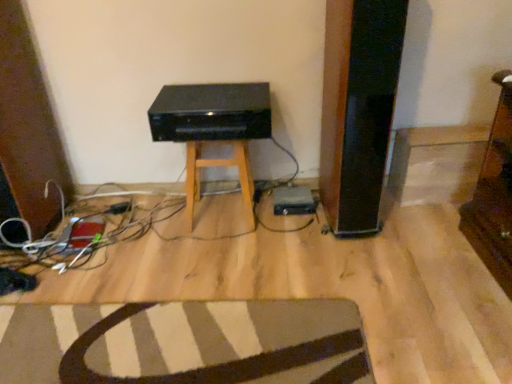
Image resolution: width=512 pixels, height=384 pixels. What are the coordinates of `free location in front of black plastic plug at lower left` in the screenshot? It's located at (105, 229).